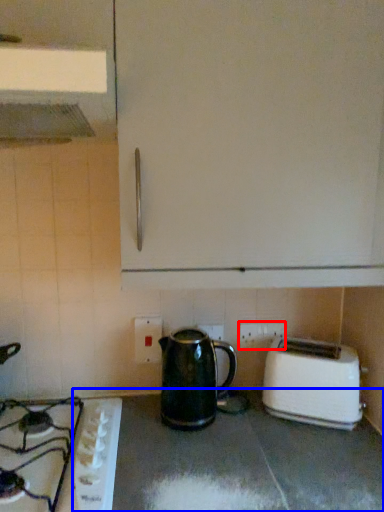
Question: Which object is closer to the camera taking this photo, electric outlet (highlighted by a red box) or counter top (highlighted by a blue box)?

Choices:
 (A) electric outlet
 (B) counter top

Answer: (B)